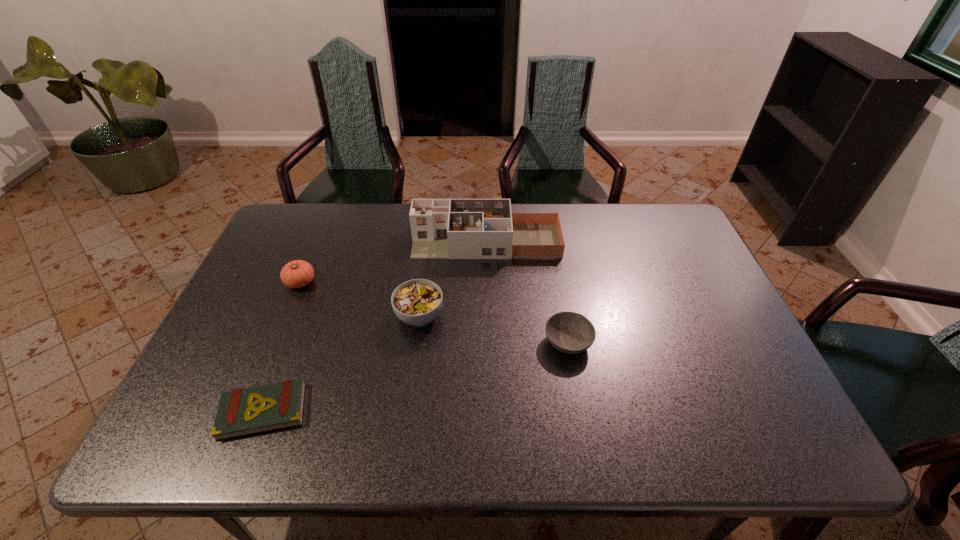
Identify the location of vacant space located 0.180m on the left of the soup bowl. This screenshot has width=960, height=540. click(328, 316).

The height and width of the screenshot is (540, 960). I want to click on vacant space located on the front of the second farthest object, so click(x=241, y=426).

The width and height of the screenshot is (960, 540). I want to click on vacant point located on the right of the bowl, so click(x=744, y=342).

The width and height of the screenshot is (960, 540). What are the coordinates of `free location located 0.150m on the back of the book` in the screenshot? It's located at (293, 334).

You are a GUI agent. You are given a task and a screenshot of the screen. Output one action in this format:
    pyautogui.click(x=<x>, y=<y>)
    Task: Click on the object located in the far edge section of the desktop
    This screenshot has width=960, height=540.
    Given the screenshot: What is the action you would take?
    pyautogui.click(x=441, y=228)

The width and height of the screenshot is (960, 540). Identify the location of object that is at the near edge. (241, 412).

Find the location of a particular element. This screenshot has height=540, width=960. tomato at the left edge is located at coordinates (298, 273).

Identify the location of book at the left edge. point(241,412).

You are a GUI agent. You are given a task and a screenshot of the screen. Output one action in this format:
    pyautogui.click(x=<x>, y=<y>)
    Task: Click on the object positioned at the near left corner
    
    Given the screenshot: What is the action you would take?
    pyautogui.click(x=241, y=412)

Where is `vacant space at the far edge of the desktop`? This screenshot has width=960, height=540. vacant space at the far edge of the desktop is located at coordinates (386, 206).